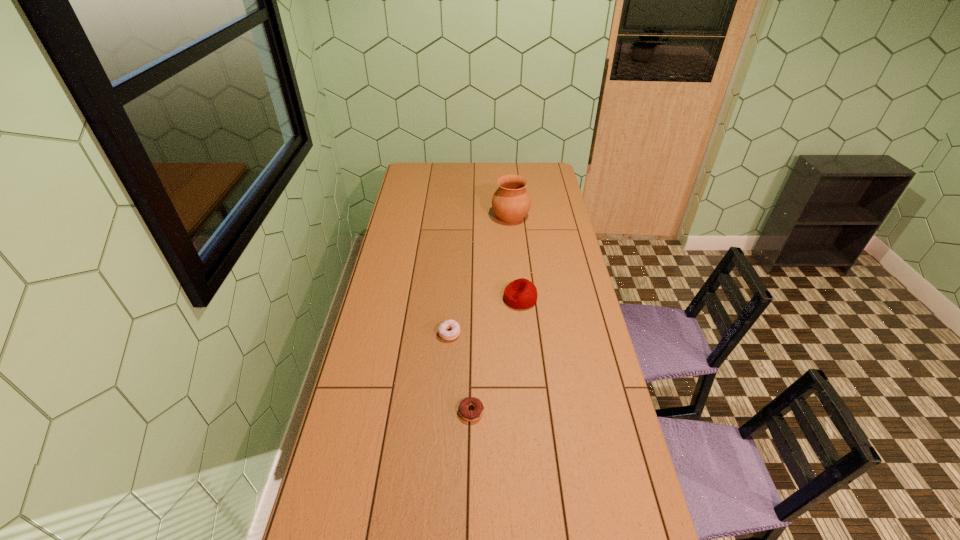
Where is `free location that satisfies the following two spatial constraints: 1. on the back side of the farthest object; 2. on the right side of the left doughnut`? free location that satisfies the following two spatial constraints: 1. on the back side of the farthest object; 2. on the right side of the left doughnut is located at coordinates (458, 217).